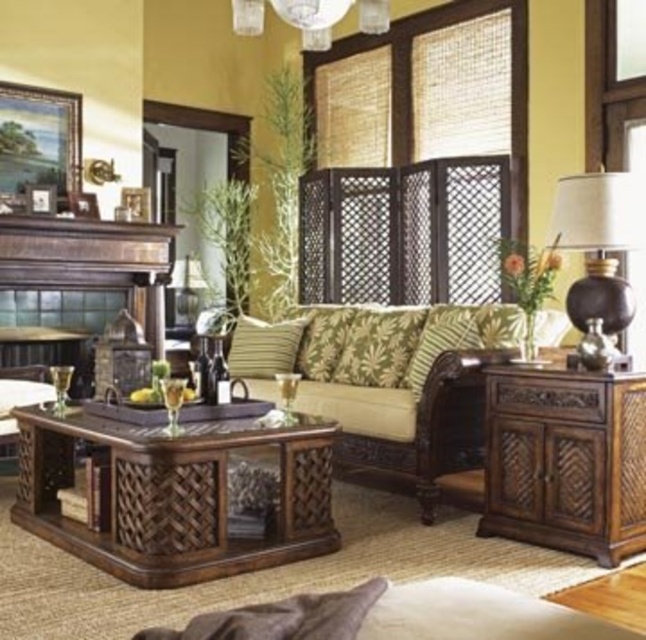
Is green textured fabric couch at center to the left of dark brown leather fireplace at center from the viewer's perspective?

Incorrect, green textured fabric couch at center is not on the left side of dark brown leather fireplace at center.

The height and width of the screenshot is (640, 646). I want to click on green textured fabric couch at center, so click(388, 387).

Which is above, brown woven table at center or matte brown lamp at right?

matte brown lamp at right is above.

Describe the element at coordinates (174, 496) in the screenshot. The height and width of the screenshot is (640, 646). I see `brown woven table at center` at that location.

Identify the location of brown woven table at center. Image resolution: width=646 pixels, height=640 pixels. (174, 496).

Does brown woven table at center appear under dark brown leather fireplace at center?

Correct, brown woven table at center is located below dark brown leather fireplace at center.

At what (x,y) coordinates should I click in order to perform the action: click on brown woven table at center. Please return your answer as a coordinate pair (x, y). Looking at the image, I should click on (174, 496).

Is point (194, 563) closer to camera compared to point (158, 262)?

Yes.

Image resolution: width=646 pixels, height=640 pixels. Find the location of `brown woven table at center`. brown woven table at center is located at coordinates (174, 496).